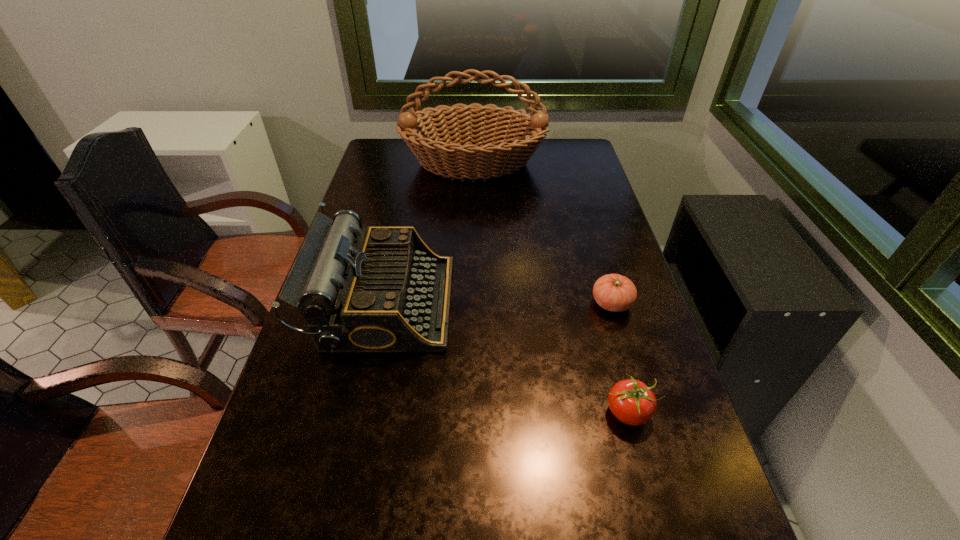
Locate an element on the screen. This screenshot has width=960, height=540. the farthest object is located at coordinates click(430, 135).

Locate an element on the screen. This screenshot has height=540, width=960. the tallest object is located at coordinates (430, 135).

Where is `the second tallest object`? This screenshot has height=540, width=960. the second tallest object is located at coordinates (386, 291).

The height and width of the screenshot is (540, 960). Identify the location of the nearer tomato. (631, 401).

At what (x,y) coordinates should I click in order to perform the action: click on the farther tomato. Please return your answer as a coordinate pair (x, y). The width and height of the screenshot is (960, 540). Looking at the image, I should click on (616, 293).

The height and width of the screenshot is (540, 960). In order to click on vacant area situated 0.160m on the front of the basket in this screenshot , I will do `click(472, 218)`.

At what (x,y) coordinates should I click in order to perform the action: click on free point located on the keyboard of the third shortest object. Please return your answer as a coordinate pair (x, y). Looking at the image, I should click on (470, 302).

The width and height of the screenshot is (960, 540). I want to click on free space located on the left of the nearer tomato, so click(448, 413).

I want to click on free point located on the back of the farther tomato, so click(x=588, y=224).

Find the location of `object situated at the far edge`. object situated at the far edge is located at coordinates (430, 135).